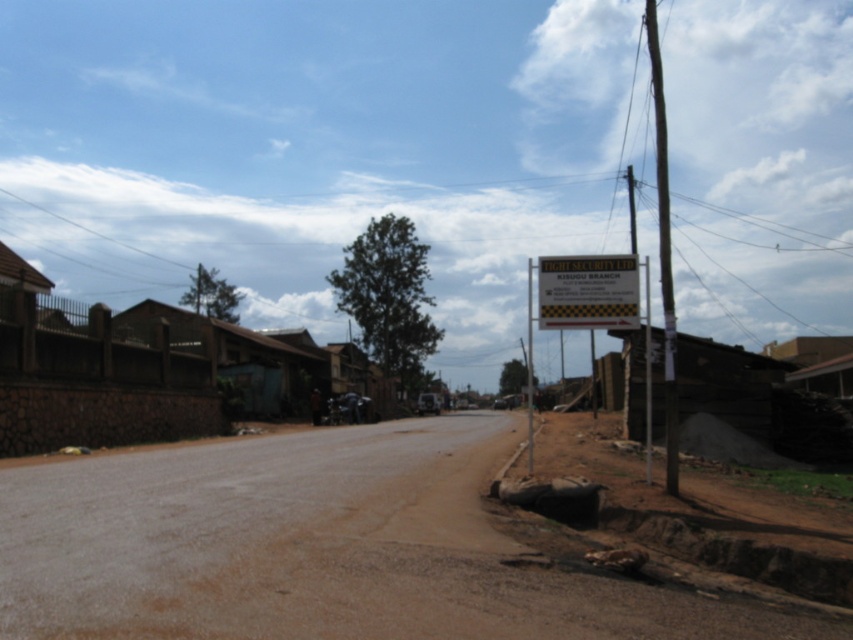
Who is positioned more to the right, brown dirt track at lower left or smooth wood pole at right?

From the viewer's perspective, smooth wood pole at right appears more on the right side.

Is brown dirt track at lower left further to camera compared to smooth wood pole at right?

No, brown dirt track at lower left is in front of smooth wood pole at right.

Does point (459, 595) come farther from viewer compared to point (670, 285)?

No, (459, 595) is closer to viewer.

At what (x,y) coordinates should I click in order to perform the action: click on brown dirt track at lower left. Please return your answer as a coordinate pair (x, y). Looking at the image, I should click on (320, 548).

Is point (218, 497) closer to camera compared to point (584, 259)?

Yes, it is.

Is brown dirt track at lower left to the right of metallic signboard at right from the viewer's perspective?

Incorrect, brown dirt track at lower left is not on the right side of metallic signboard at right.

Is point (457, 481) in front of point (566, 285)?

No, it is not.

Locate an element on the screen. The image size is (853, 640). brown dirt track at lower left is located at coordinates (320, 548).

Image resolution: width=853 pixels, height=640 pixels. What do you see at coordinates (583, 292) in the screenshot? I see `metallic signboard at right` at bounding box center [583, 292].

Who is more distant from viewer, (578,317) or (608,291)?

The point (578,317) is behind.

Which is behind, point (625, 285) or point (582, 282)?

The point (582, 282) is behind.

The image size is (853, 640). I want to click on metallic signboard at right, so click(x=583, y=292).